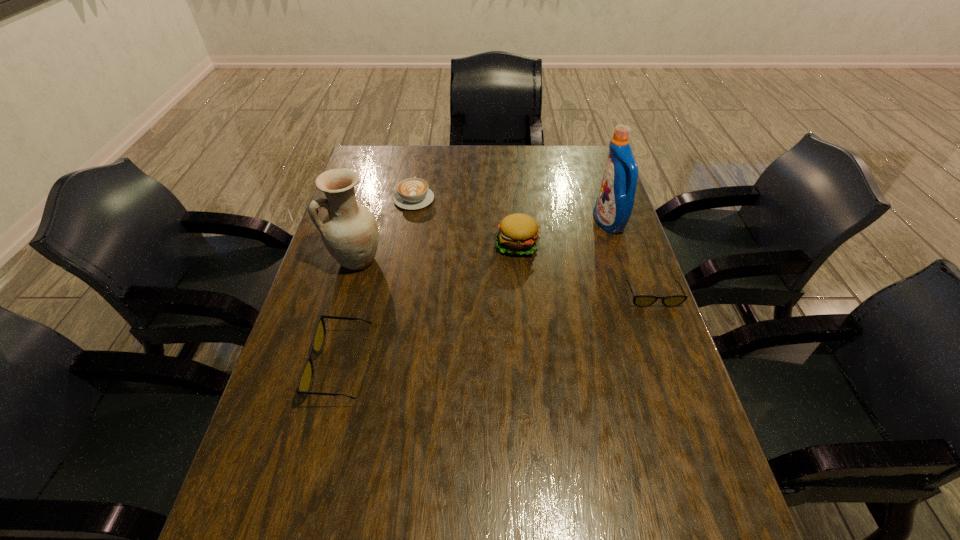
I want to click on free space located on the side of the cappuccino with the handle, so click(x=419, y=173).

This screenshot has width=960, height=540. In order to click on vacant area situated 0.210m on the side of the cappuccino with the handle in this screenshot , I will do `click(421, 155)`.

This screenshot has width=960, height=540. I want to click on free space located on the back of the third tallest object, so click(x=512, y=175).

This screenshot has width=960, height=540. I want to click on blank area located on the label of the detergent, so click(536, 222).

At what (x,y) coordinates should I click in order to perform the action: click on vacant region located 0.120m on the label of the detergent. Please return your answer as a coordinate pair (x, y). Looking at the image, I should click on (558, 222).

The width and height of the screenshot is (960, 540). I want to click on vacant space located on the label of the detergent, so coord(523,222).

This screenshot has width=960, height=540. Identify the location of vacant region located on the right of the pottery. (443, 260).

Where is `sunglasses situated at the left edge`? sunglasses situated at the left edge is located at coordinates (305, 381).

Identify the location of pottery that is at the left edge. (350, 233).

Where is `sunglasses that is at the right edge`? sunglasses that is at the right edge is located at coordinates (639, 300).